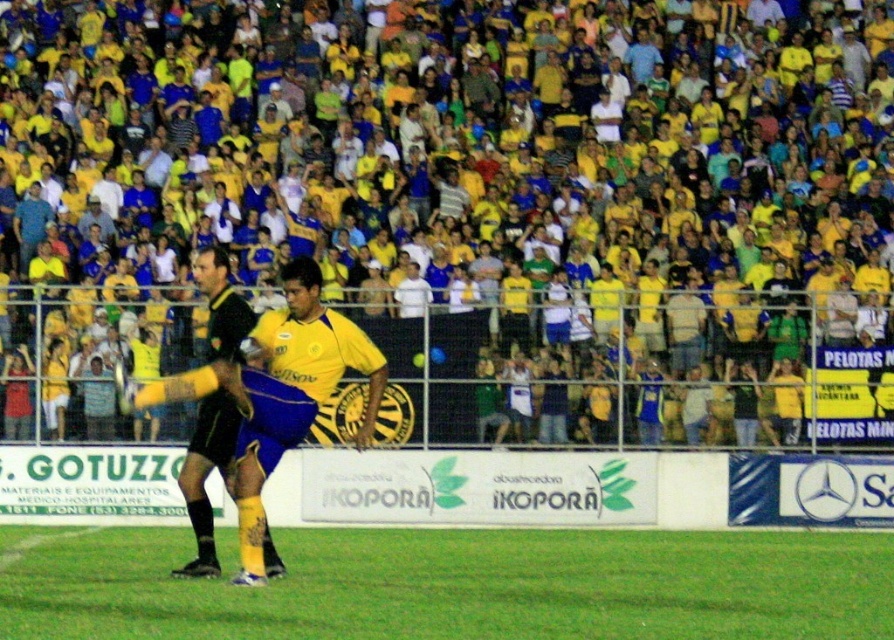
Does yellow/yellowish fabric at upper center appear on the left side of black matte jersey at center?

Incorrect, yellow/yellowish fabric at upper center is not on the left side of black matte jersey at center.

Which is more to the right, yellow/yellowish fabric at upper center or black matte jersey at center?

Positioned to the right is yellow/yellowish fabric at upper center.

Between point (648, 65) and point (242, 337), which one is positioned behind?

Point (648, 65)

At what (x,y) coordinates should I click in order to perform the action: click on yellow/yellowish fabric at upper center. Please return your answer as a coordinate pair (x, y). The height and width of the screenshot is (640, 894). Looking at the image, I should click on point(462,209).

Is green grass at lower center to the left of black matte jersey at center from the viewer's perspective?

In fact, green grass at lower center is to the right of black matte jersey at center.

This screenshot has height=640, width=894. Describe the element at coordinates (454, 584) in the screenshot. I see `green grass at lower center` at that location.

This screenshot has height=640, width=894. What are the coordinates of `green grass at lower center` in the screenshot? It's located at (x=454, y=584).

What are the coordinates of `yellow/yellowish fabric at upper center` in the screenshot? It's located at (462, 209).

Can you confirm if yellow/yellowish fabric at upper center is wider than yellow matte jersey at center?

Indeed, yellow/yellowish fabric at upper center has a greater width compared to yellow matte jersey at center.

Who is more distant from viewer, (887, 88) or (243, 384)?

Positioned behind is point (887, 88).

Identify the location of yellow/yellowish fabric at upper center. The image size is (894, 640). (462, 209).